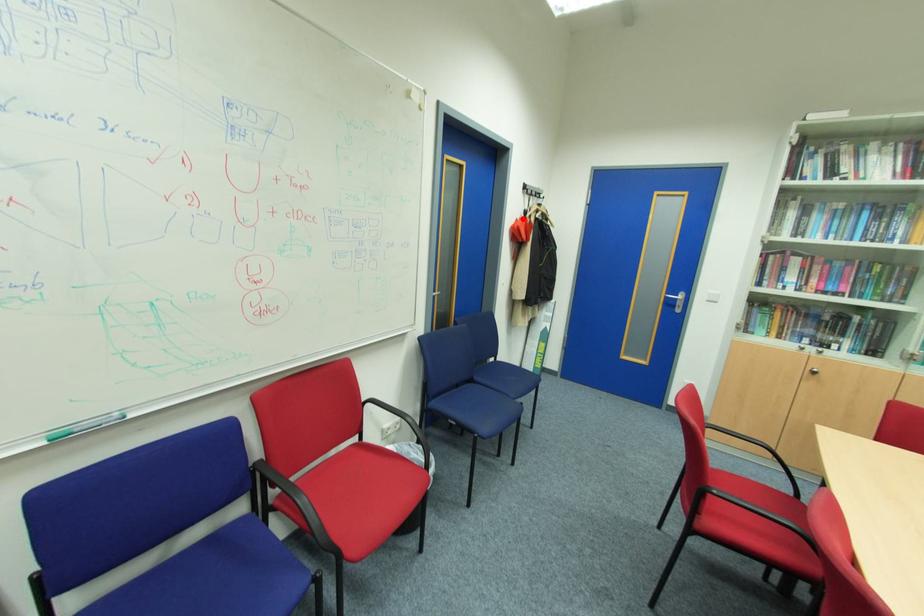
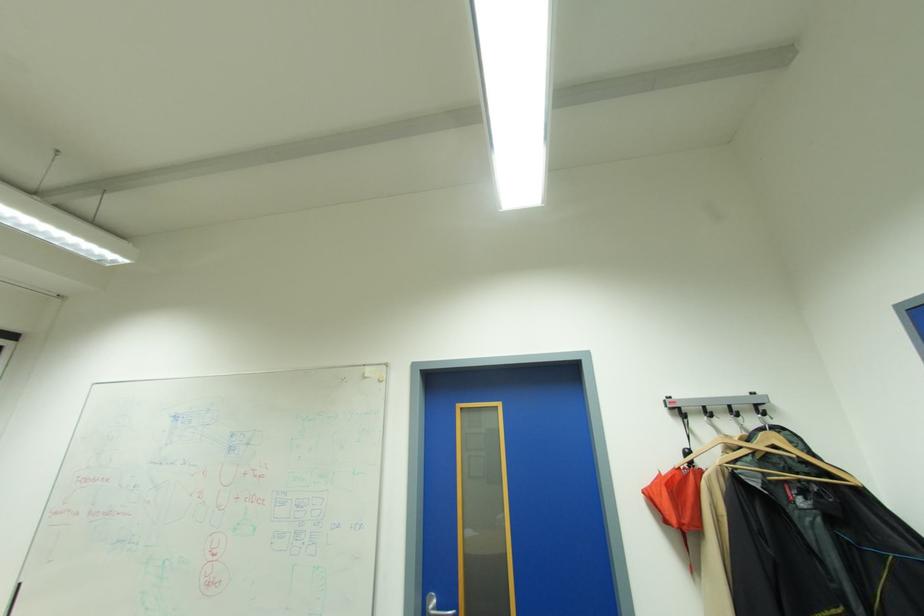
In the second image, find the point that corresponds to the highlighted location in the first image.

(667, 474)